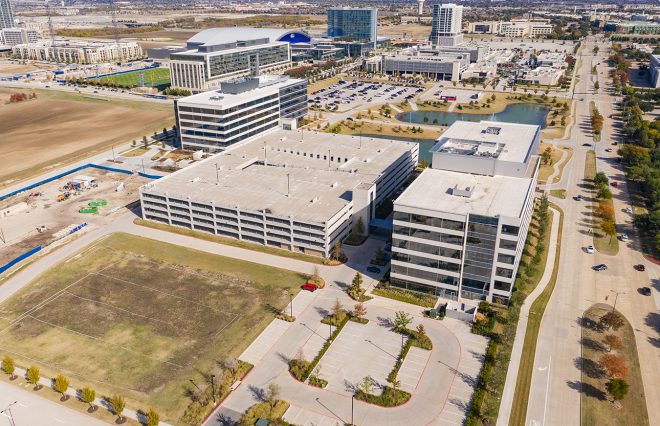
Identify the location of entrance. (475, 296), (341, 244), (312, 57), (255, 70), (439, 76), (436, 39).